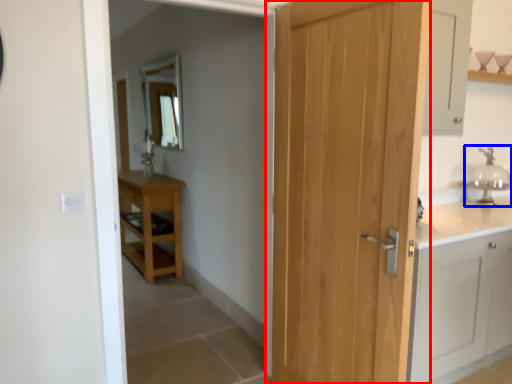
Question: Which point is further to the camera, door (highlighted by a red box) or faucet (highlighted by a blue box)?

Choices:
 (A) door
 (B) faucet

Answer: (B)